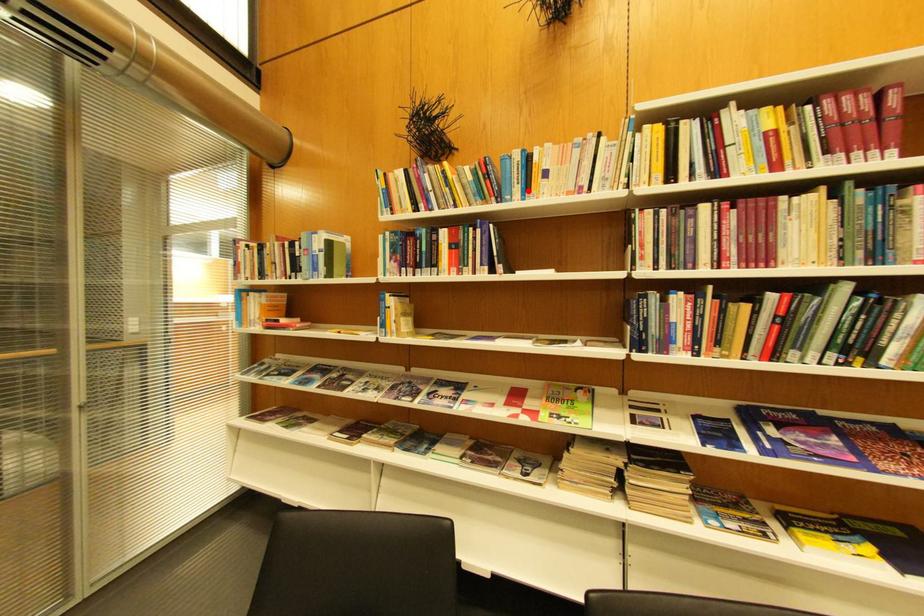
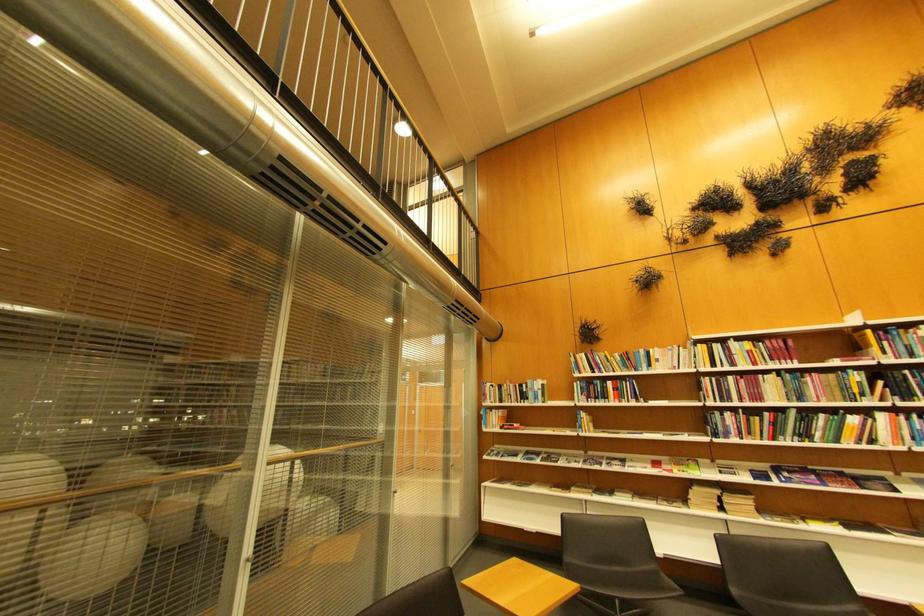
Locate, in the second image, the point that corresponds to the highlighted location in the first image.

(654, 368)